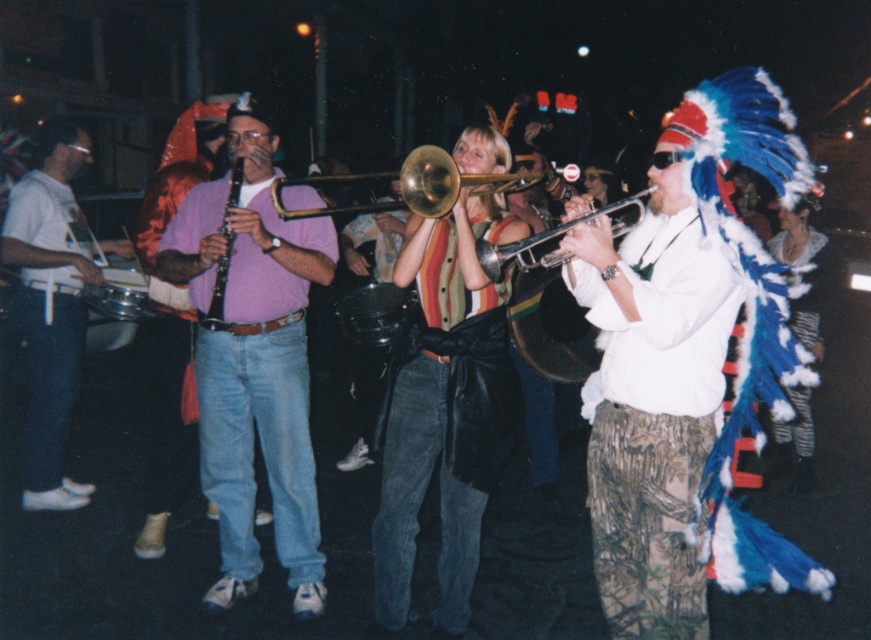
Question: Which point is farther from the camera taking this photo?

Choices:
 (A) (75, 330)
 (B) (542, 273)
 (C) (799, 262)
 (D) (635, 385)

Answer: (C)

Question: Does white matte shirt at left lie behind gold brass trombone at center?

Choices:
 (A) no
 (B) yes

Answer: (B)

Question: Which of the following is the closest to the observer?

Choices:
 (A) (356, 301)
 (B) (130, 301)
 (C) (619, 230)

Answer: (C)

Question: From the image, what is the correct spatial relationship of camo-patterned pants at right in relation to white fluffy headdress at right?

Choices:
 (A) left
 (B) right

Answer: (A)

Question: Which is farther from the pink matte shirt at center?

Choices:
 (A) white matte shirt at left
 (B) camo-patterned pants at right

Answer: (B)

Question: Does black matte drum at center appear on the left side of shiny silver drum at left?

Choices:
 (A) no
 (B) yes

Answer: (A)